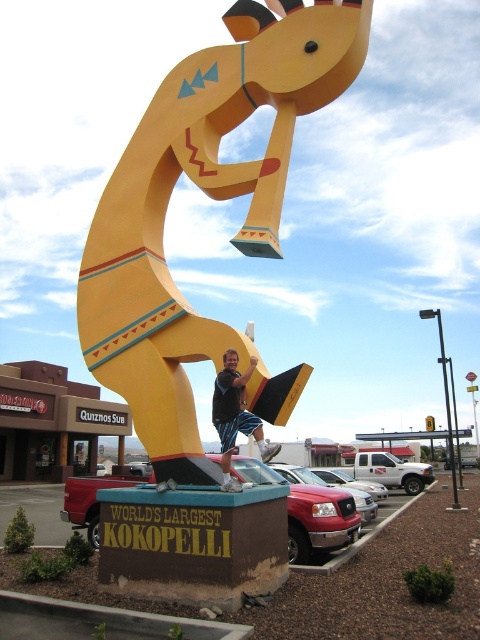
Can you confirm if metallic red truck at center is positioned below matte black shorts at center?

Indeed, metallic red truck at center is positioned under matte black shorts at center.

Does metallic red truck at center appear on the left side of matte black shorts at center?

Indeed, metallic red truck at center is positioned on the left side of matte black shorts at center.

Who is more distant from viewer, (323,550) or (261,444)?

Positioned behind is point (323,550).

You are a GUI agent. You are given a task and a screenshot of the screen. Output one action in this format:
    pyautogui.click(x=<x>, y=<y>)
    Task: Click on the metallic red truck at center
    The height and width of the screenshot is (640, 480).
    Given the screenshot: What is the action you would take?
    [x=57, y=506]

Between yellow matte kokopelli at center and matte black shorts at center, which one has more height?

With more height is yellow matte kokopelli at center.

At what (x,y) coordinates should I click in order to perform the action: click on yellow matte kokopelli at center. Please return your answer as a coordinate pair (x, y). The height and width of the screenshot is (640, 480). Looking at the image, I should click on (210, 196).

Image resolution: width=480 pixels, height=640 pixels. Describe the element at coordinates (210, 196) in the screenshot. I see `yellow matte kokopelli at center` at that location.

The width and height of the screenshot is (480, 640). Find the location of `yellow matte kokopelli at center`. yellow matte kokopelli at center is located at coordinates (210, 196).

Between point (120, 170) and point (93, 490), which one is positioned behind?

Point (93, 490)

Is yellow matte kokopelli at center thinner than metallic red truck at center?

Indeed, yellow matte kokopelli at center has a lesser width compared to metallic red truck at center.

Is point (248, 77) farther from camera compared to point (316, 484)?

No.

Locate an element on the screen. This screenshot has width=480, height=640. yellow matte kokopelli at center is located at coordinates (210, 196).